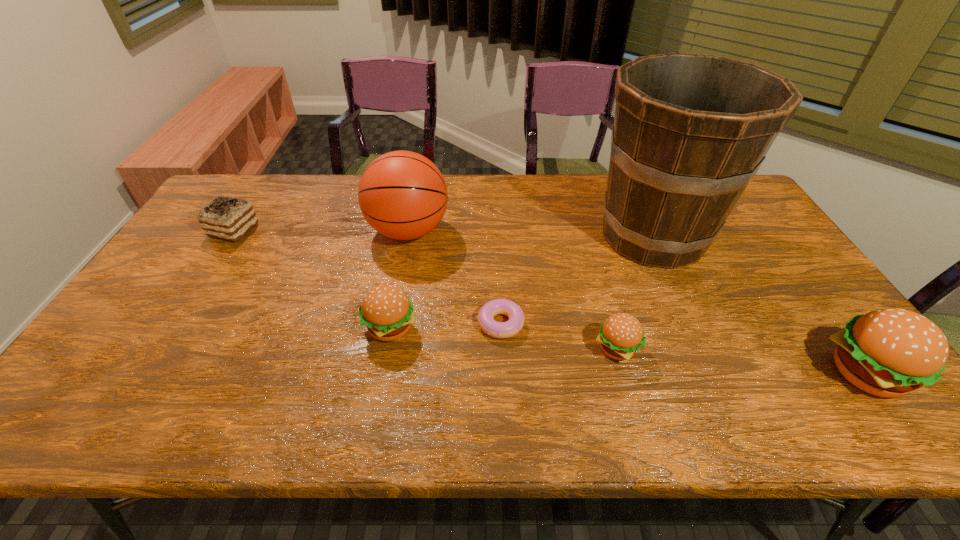
Identify the location of vacant space that is in between the second tallest object and the fourth object from left to right. The width and height of the screenshot is (960, 540). (455, 277).

Where is `empty space between the tallest object and the rightmost object`? The image size is (960, 540). empty space between the tallest object and the rightmost object is located at coordinates (759, 304).

At what (x,y) coordinates should I click in order to perform the action: click on vacant region between the second tallest object and the shortest hamburger. Please return your answer as a coordinate pair (x, y). The height and width of the screenshot is (540, 960). Looking at the image, I should click on (513, 290).

Find the location of `vacant area that lies between the shortest object and the bucket`. vacant area that lies between the shortest object and the bucket is located at coordinates pyautogui.click(x=577, y=280).

What are the coordinates of `free area in between the rightmost hamburger and the tallest object` in the screenshot? It's located at (759, 304).

Image resolution: width=960 pixels, height=540 pixels. Find the location of `free area in between the shortest hamburger and the bucket`. free area in between the shortest hamburger and the bucket is located at coordinates (635, 292).

Choose which object is the nearest neighbor to the shortest object. Please provide its 2D coordinates. Your answer should be formatted as a tuple, i.e. [(x, y)], where the tuple contains the x and y coordinates of a point satisfying the conditions above.

[(387, 312)]

I want to click on object that is the fifth closest to the doughnut, so click(x=890, y=352).

Identify which hamburger is the third closest to the leftmost object. Please provide its 2D coordinates. Your answer should be formatted as a tuple, i.e. [(x, y)], where the tuple contains the x and y coordinates of a point satisfying the conditions above.

[(890, 352)]

Locate an element on the screen. This screenshot has width=960, height=540. hamburger that is the second closest to the fourth tallest object is located at coordinates (890, 352).